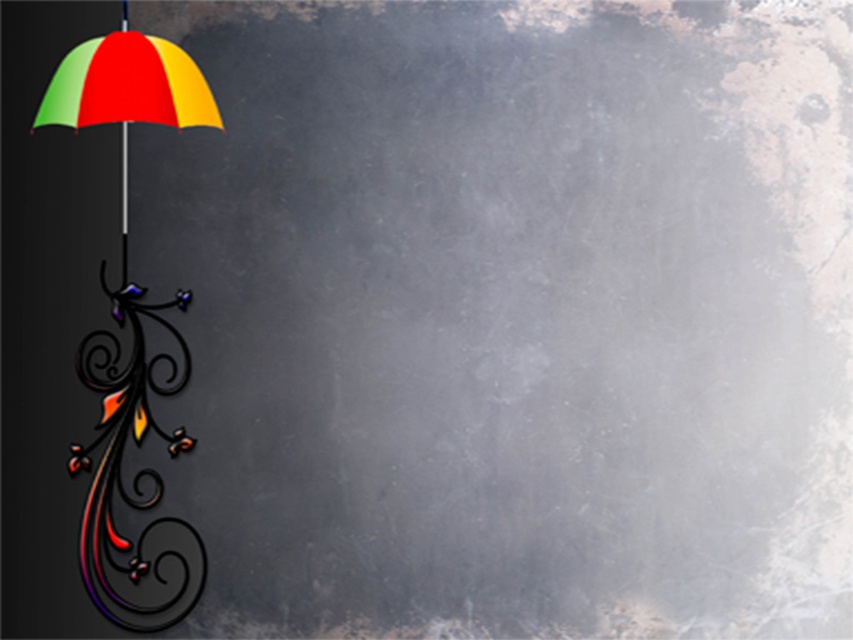
Does metallic swirl at left have a smaller size compared to multicolored glossy umbrella at left?

Indeed, metallic swirl at left has a smaller size compared to multicolored glossy umbrella at left.

Is point (131, 561) more distant than point (126, 118)?

Yes, point (131, 561) is farther from viewer.

You are a GUI agent. You are given a task and a screenshot of the screen. Output one action in this format:
    pyautogui.click(x=<x>, y=<y>)
    Task: Click on the metallic swirl at left
    The image size is (853, 640).
    Given the screenshot: What is the action you would take?
    pyautogui.click(x=120, y=461)

Where is `multicolored glossy umbrella at left`? multicolored glossy umbrella at left is located at coordinates click(x=126, y=92).

Is the position of multicolored glossy umbrella at left less distant than that of metallic pole at left?

Yes, it is in front of metallic pole at left.

Find the location of a particular element. The height and width of the screenshot is (640, 853). multicolored glossy umbrella at left is located at coordinates click(126, 92).

The image size is (853, 640). What are the coordinates of `multicolored glossy umbrella at left` in the screenshot? It's located at (126, 92).

Is metallic swirl at left to the right of metallic pole at left from the viewer's perspective?

Indeed, metallic swirl at left is positioned on the right side of metallic pole at left.

Is metallic swirl at left positioned before metallic pole at left?

No, it is behind metallic pole at left.

In order to click on metallic swirl at left in this screenshot , I will do `click(120, 461)`.